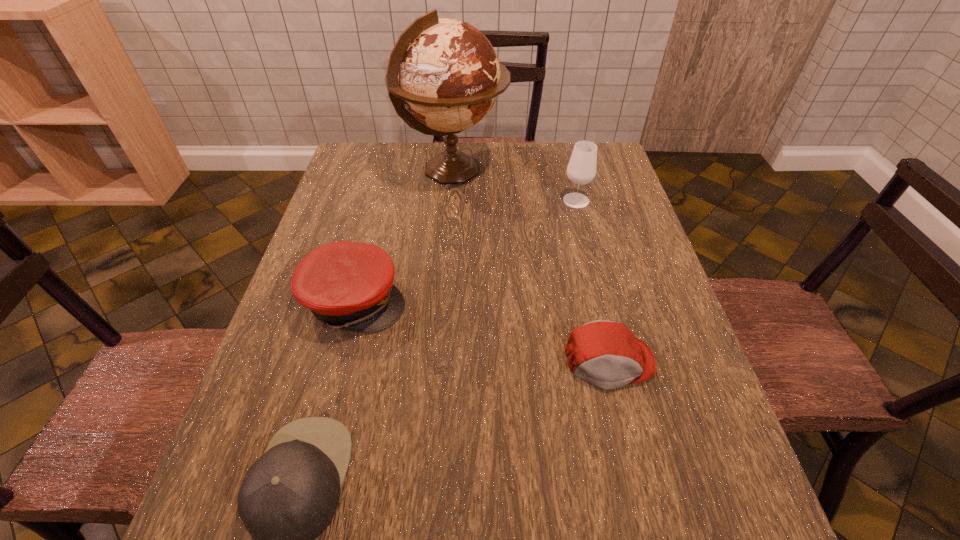
The height and width of the screenshot is (540, 960). In order to click on globe in this screenshot , I will do `click(444, 71)`.

Identify the location of glass. (581, 169).

Where is `the shortest cap`? the shortest cap is located at coordinates (607, 354).

Image resolution: width=960 pixels, height=540 pixels. Identify the location of the rightmost cap. (607, 354).

The image size is (960, 540). I want to click on free space located on the front of the globe showing Asia, so click(x=603, y=171).

Identify the location of vacant space located on the front of the fourth shortest object. (584, 231).

At what (x,y) coordinates should I click in order to perform the action: click on vacant space situated 0.180m on the front-facing side of the shortest object. Please return your answer as a coordinate pair (x, y). Looking at the image, I should click on (639, 488).

At what (x,y) coordinates should I click in order to perform the action: click on object situated at the far edge. Please return your answer as a coordinate pair (x, y). Looking at the image, I should click on (444, 71).

I want to click on object that is positioned at the left edge, so click(x=349, y=285).

Find the location of a particular element. The width and height of the screenshot is (960, 540). glass positioned at the right edge is located at coordinates (581, 169).